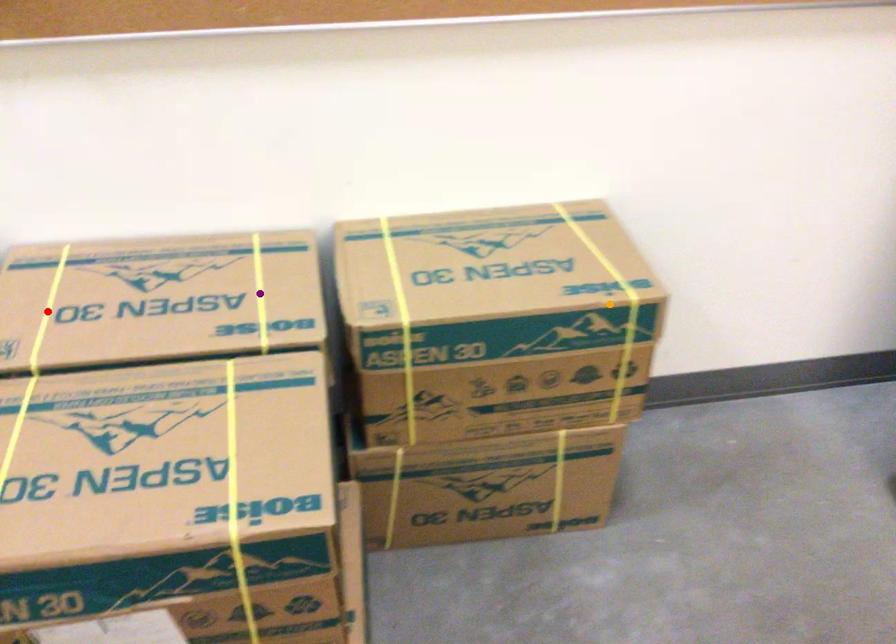
Order these from nearest to farthest:
A) orange point
B) purple point
C) red point

red point < orange point < purple point